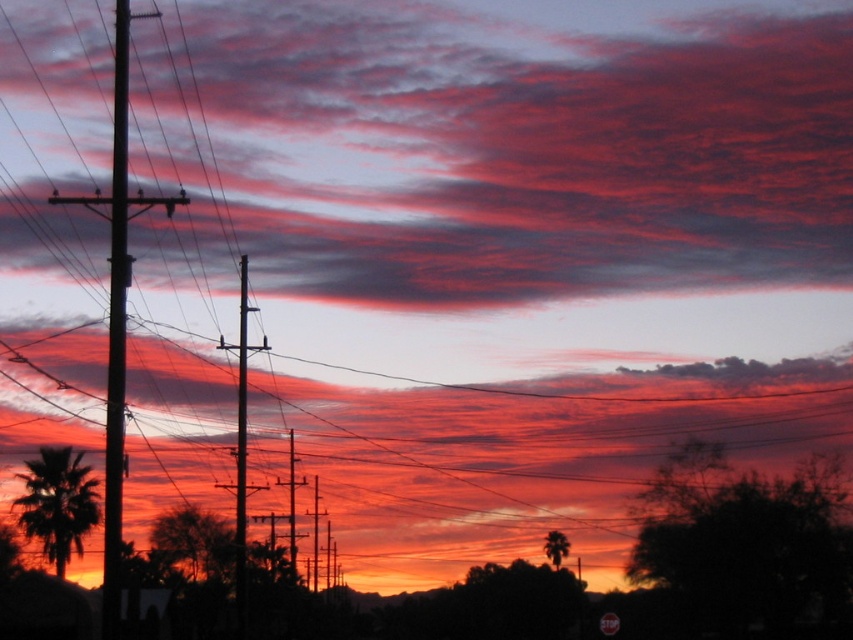
Is point (236, 580) less distant than point (611, 618)?

Yes, it is in front of point (611, 618).

Looking at this image, is smooth wood telegraph pole at center smaller than metallic red stop sign at lower right?

Actually, smooth wood telegraph pole at center might be larger than metallic red stop sign at lower right.

Image resolution: width=853 pixels, height=640 pixels. Describe the element at coordinates (241, 436) in the screenshot. I see `smooth wood telegraph pole at center` at that location.

Identify the location of smooth wood telegraph pole at center. (241, 436).

Based on the photo, does matte red cloud at upper center have a greater width compared to metallic red stop sign at lower right?

Correct, the width of matte red cloud at upper center exceeds that of metallic red stop sign at lower right.

Between matte red cloud at upper center and metallic red stop sign at lower right, which one appears on the left side from the viewer's perspective?

metallic red stop sign at lower right

Is point (575, 77) closer to viewer compared to point (614, 620)?

No, (575, 77) is further to viewer.

At what (x,y) coordinates should I click in order to perform the action: click on matte red cloud at upper center. Please return your answer as a coordinate pair (x, y). Looking at the image, I should click on (491, 150).

Describe the element at coordinates (115, 332) in the screenshot. The image size is (853, 640). I see `smooth wood telegraph pole at left` at that location.

The width and height of the screenshot is (853, 640). What do you see at coordinates (115, 332) in the screenshot?
I see `smooth wood telegraph pole at left` at bounding box center [115, 332].

Locate an element on the screen. The height and width of the screenshot is (640, 853). smooth wood telegraph pole at left is located at coordinates (115, 332).